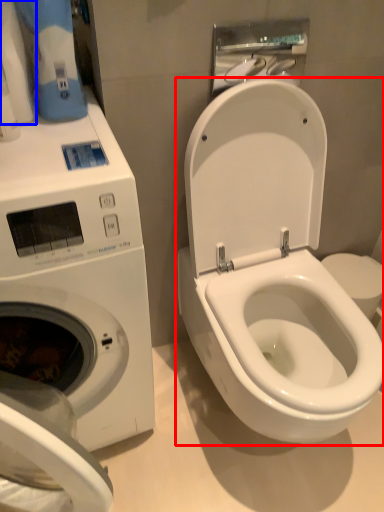
Question: Which point is closer to the camera, toilet (highlighted by a red box) or toilet paper (highlighted by a blue box)?

Choices:
 (A) toilet
 (B) toilet paper

Answer: (A)